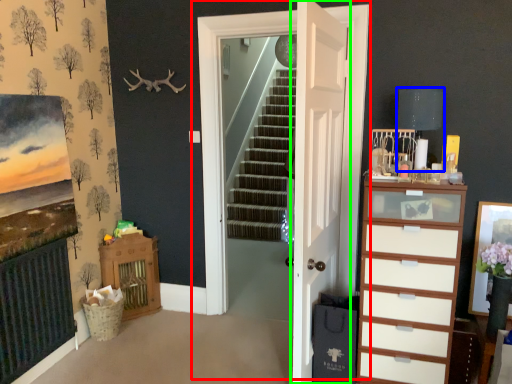
Question: Which object is positioned farthest from door (highlighted by a red box)? Select from lamp (highlighted by a blue box) and door (highlighted by a green box).

Choices:
 (A) lamp
 (B) door

Answer: (A)